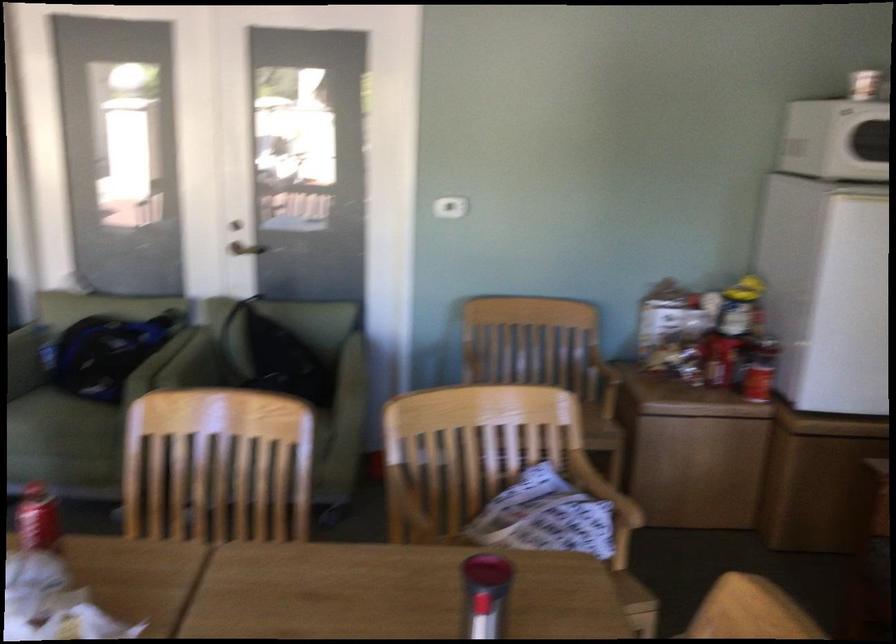
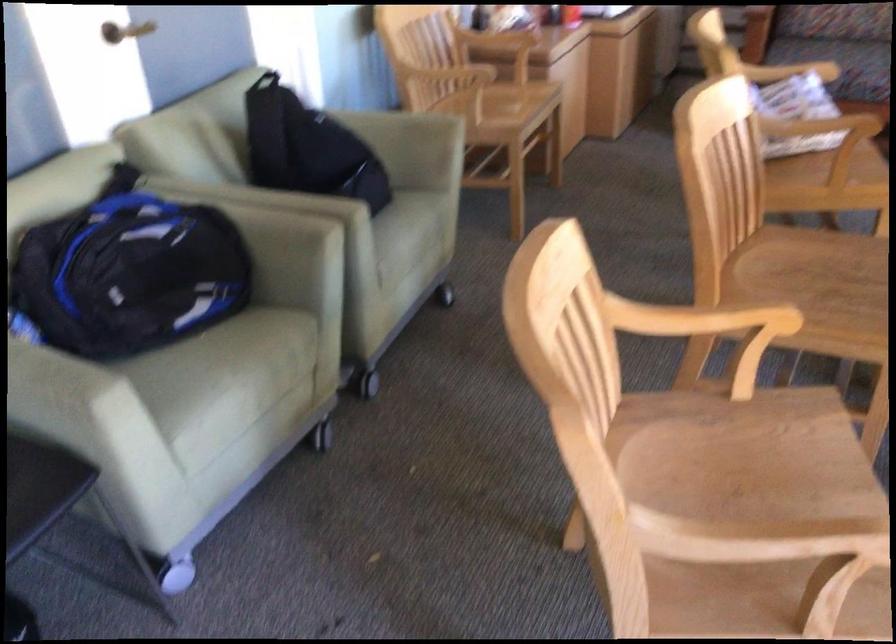
Find the pixel in the second image that matches point 177,357 in the first image.

(250, 194)